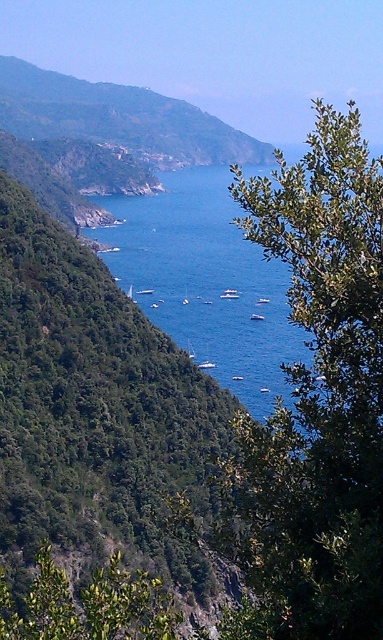
Question: Which of the following is the closest to the observer?

Choices:
 (A) green leafy hillside at upper left
 (B) white glossy boat at center
 (C) blue water at center
 (D) green leafy tree at lower left

Answer: (D)

Question: Is green leafy tree at lower left to the right of white glossy boat at center from the viewer's perspective?

Choices:
 (A) no
 (B) yes

Answer: (A)

Question: Can you confirm if green leafy tree at lower left is smaller than white glossy boat at center?

Choices:
 (A) no
 (B) yes

Answer: (A)

Question: Which is farther from the green leafy hillside at upper left?

Choices:
 (A) white glossy boat at center
 (B) green leafy tree at right

Answer: (B)

Question: Which of the following is the closest to the observer?

Choices:
 (A) (327, 499)
 (B) (222, 148)
 (C) (207, 365)

Answer: (A)

Question: Does green leafy tree at right appear on the left side of blue water at center?

Choices:
 (A) no
 (B) yes

Answer: (A)